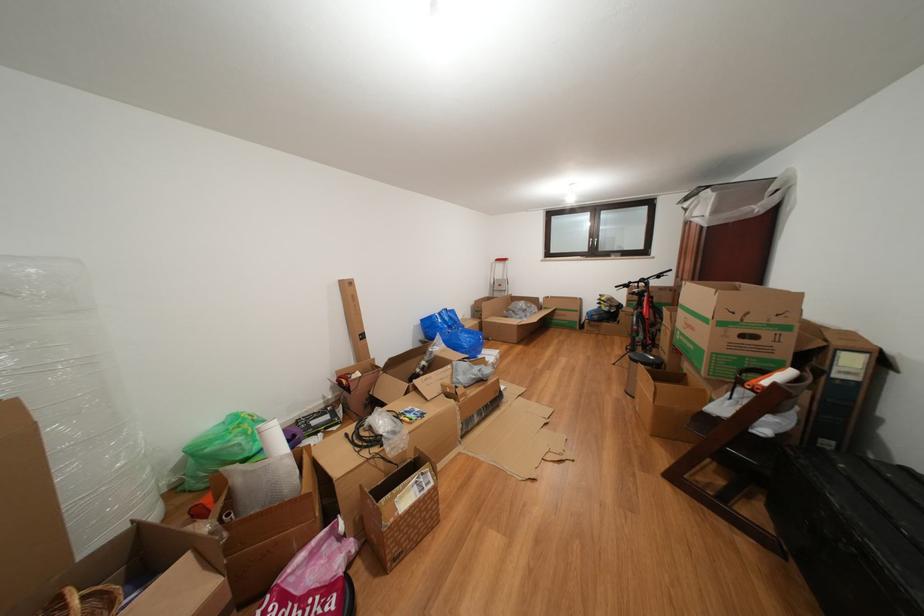
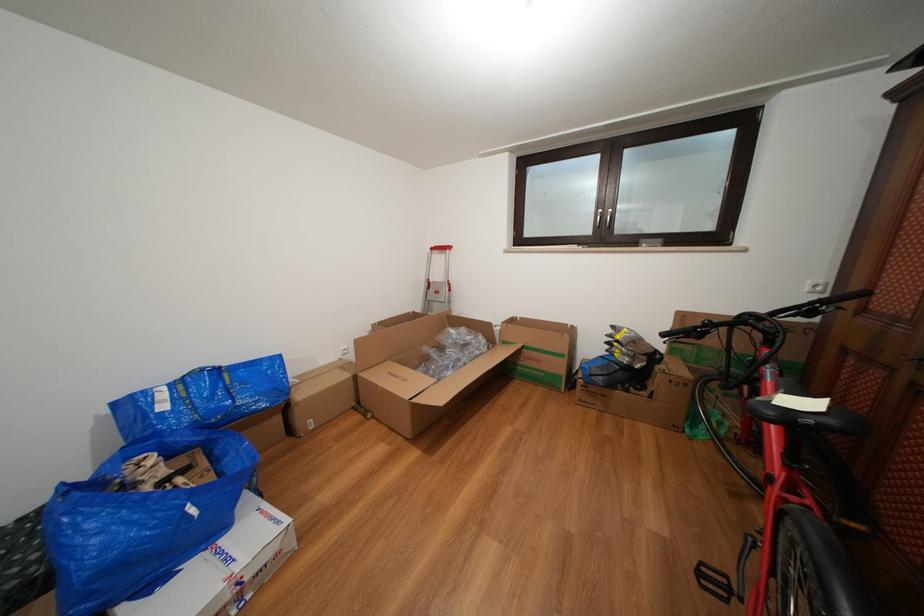
Find the pixel in the second image that matches the point at 475,331 in the first image.

(309, 400)